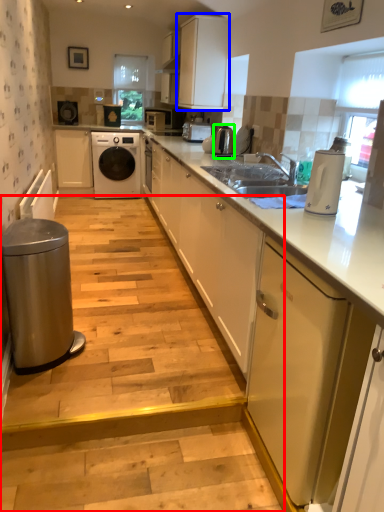
Question: Estimate the real-world distances between objects in this image. Which object is farther from stair (highlighted by a red box), cabinetry (highlighted by a blue box) or kitchen appliance (highlighted by a green box)?

Choices:
 (A) cabinetry
 (B) kitchen appliance

Answer: (A)